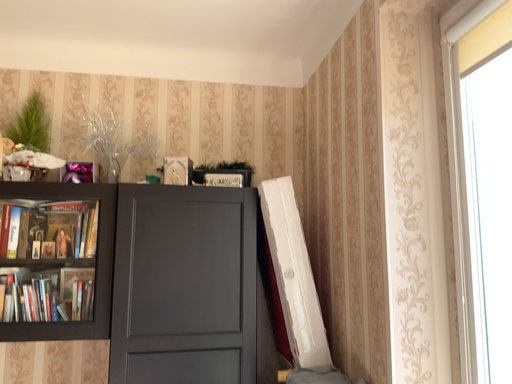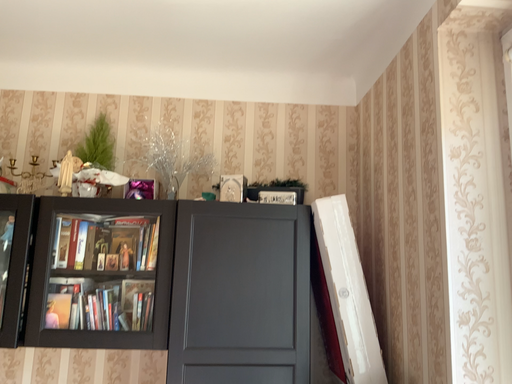
Question: How did the camera likely rotate when shooting the video?

Choices:
 (A) rotated right
 (B) rotated left

Answer: (B)